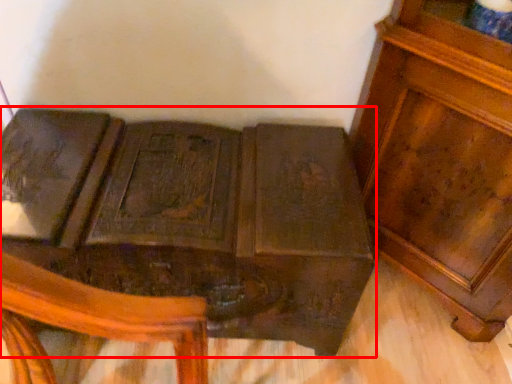
Question: From the image's perspective, where is furniture (annotated by the red box) located in relation to furniture in the image?

Choices:
 (A) above
 (B) below

Answer: (B)